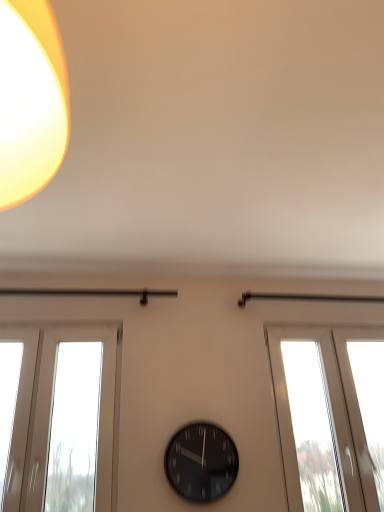
Question: Is black glass clock at center wider or thinner than white glossy window at right?

Choices:
 (A) thin
 (B) wide

Answer: (A)

Question: Does point (205, 422) appear closer or farther from the camera than point (309, 407)?

Choices:
 (A) closer
 (B) farther

Answer: (A)

Question: From a real-world perspective, is black glass clock at center physically located above or below white glossy window at right?

Choices:
 (A) above
 (B) below

Answer: (B)

Question: In terms of height, does white glossy window at right look taller or shorter compared to black glass clock at center?

Choices:
 (A) tall
 (B) short

Answer: (A)

Question: Is white glossy window at right in front of or behind black glass clock at center in the image?

Choices:
 (A) front
 (B) behind

Answer: (B)

Question: From a real-world perspective, is white glossy window at right physically located above or below black glass clock at center?

Choices:
 (A) above
 (B) below

Answer: (A)

Question: Looking at the image, does white glossy window at right seem bigger or smaller compared to black glass clock at center?

Choices:
 (A) big
 (B) small

Answer: (A)